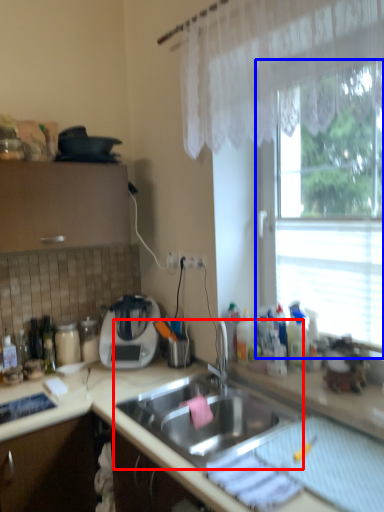
Question: Which of the following is the farthest to the observer, sink (highlighted by a red box) or window (highlighted by a blue box)?

Choices:
 (A) sink
 (B) window

Answer: (B)